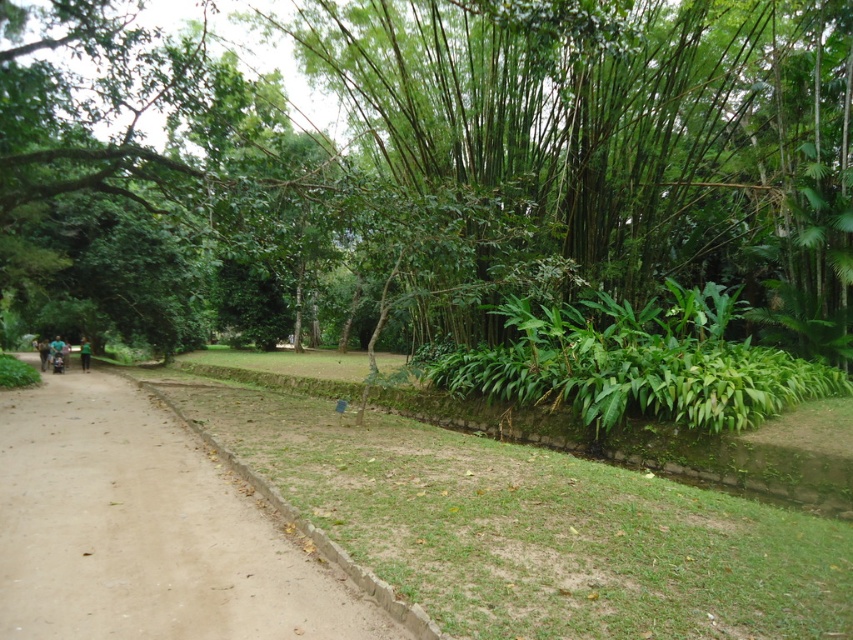
You are standing at the point labeled as point (148, 531) in the park. What is the immediate surface you are standing on?

The point (148, 531) corresponds to the brown dirt track at center, so you are standing on the brown dirt track at center.